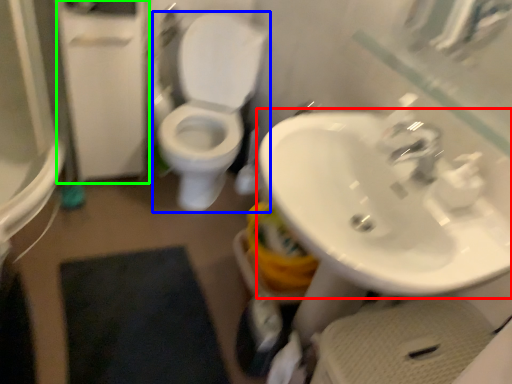
Question: Which object is positioned farthest from sink (highlighted by a red box)? Select from toilet (highlighted by a blue box) and screen door (highlighted by a green box).

Choices:
 (A) toilet
 (B) screen door

Answer: (B)